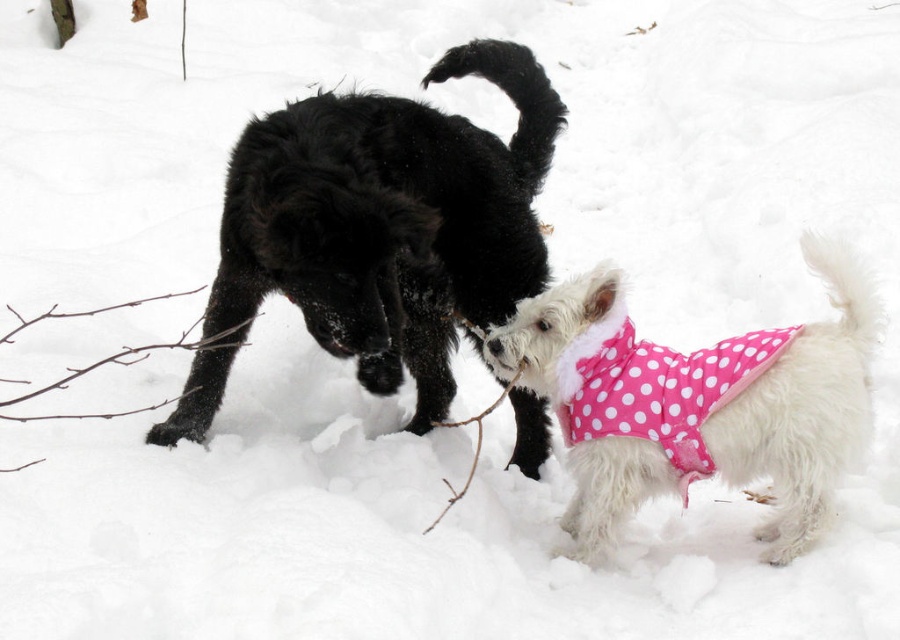
Is pink polka dot fabric at lower right smaller than pink polka dot fabric at right?

Actually, pink polka dot fabric at lower right might be larger than pink polka dot fabric at right.

Is point (799, 419) behind point (591, 369)?

No, (799, 419) is in front of (591, 369).

The height and width of the screenshot is (640, 900). What are the coordinates of `pink polka dot fabric at lower right` in the screenshot? It's located at (698, 403).

Between point (402, 362) and point (576, 426), which one is positioned behind?

The point (402, 362) is more distant.

Where is `shiny black fur at center`? The height and width of the screenshot is (640, 900). shiny black fur at center is located at coordinates (392, 220).

Is point (338, 337) positioned in front of point (831, 396)?

Yes, point (338, 337) is closer to viewer.

Identify the location of shiny black fur at center. (392, 220).

Is shiny black fur at center below pink polka dot fabric at right?

No, shiny black fur at center is not below pink polka dot fabric at right.

Does shiny black fur at center have a greater width compared to pink polka dot fabric at right?

Indeed, shiny black fur at center has a greater width compared to pink polka dot fabric at right.

Is point (223, 205) closer to viewer compared to point (626, 326)?

No, it is behind (626, 326).

This screenshot has height=640, width=900. Find the location of `shiny black fur at center`. shiny black fur at center is located at coordinates (392, 220).